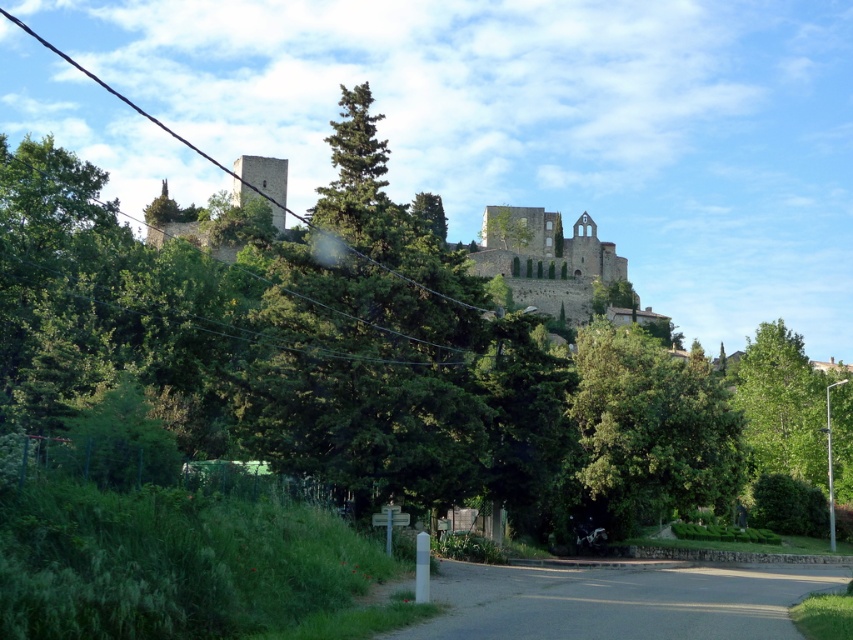
You are standing at a viewpoint looking towards the historic stone structure. You see two points marked on the image, one at coordinates point (318, 467) and another at point (498, 225). Which point is closer to you?

Point (318, 467) is in front of point (498, 225), so it is closer to you.

You are standing at point (635, 445) and want to walk towards the historic stone structure on the hill. Which direction should you go relative to point (589, 332)?

Since point (589, 332) is behind point (635, 445), you should walk towards the direction of point 0.519, 0.519 to reach the historic stone structure on the hill.